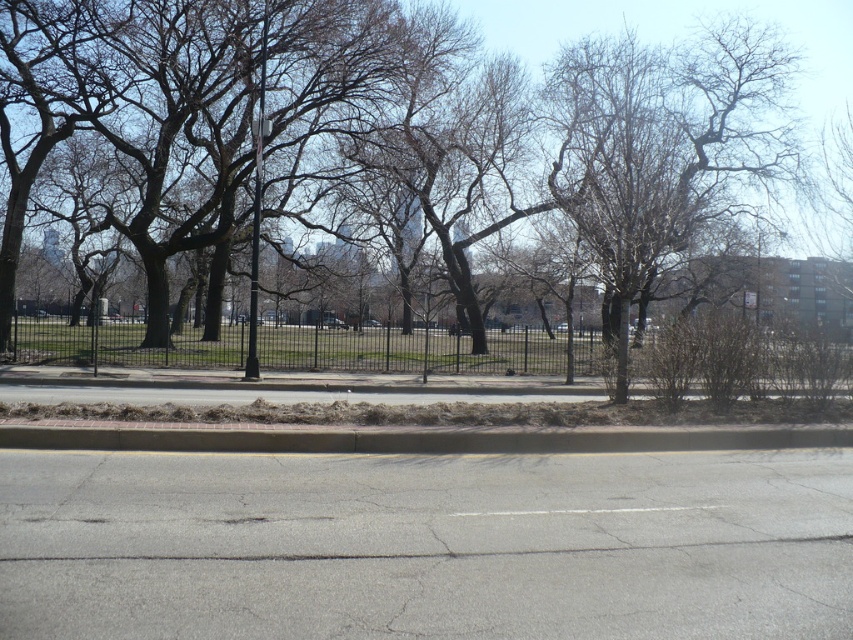
Does brown bark tree at left have a greater width compared to asphalt road at center?

Indeed, brown bark tree at left has a greater width compared to asphalt road at center.

Does brown bark tree at left appear under asphalt road at center?

No.

Where is `brown bark tree at left`? brown bark tree at left is located at coordinates [x=524, y=141].

Is bare branches at center positioned at the back of white asphalt line at center?

Yes, bare branches at center is behind white asphalt line at center.

Is bare branches at center taller than white asphalt line at center?

Indeed, bare branches at center has a greater height compared to white asphalt line at center.

Locate an element on the screen. This screenshot has width=853, height=640. bare branches at center is located at coordinates (662, 145).

Locate an element on the screen. The image size is (853, 640). bare branches at center is located at coordinates (662, 145).

Looking at this image, can you confirm if bare branches at center is wider than black metal fence at center?

In fact, bare branches at center might be narrower than black metal fence at center.

Is point (668, 161) positioned before point (83, 365)?

No, it is behind (83, 365).

What are the coordinates of `bare branches at center` in the screenshot? It's located at (662, 145).